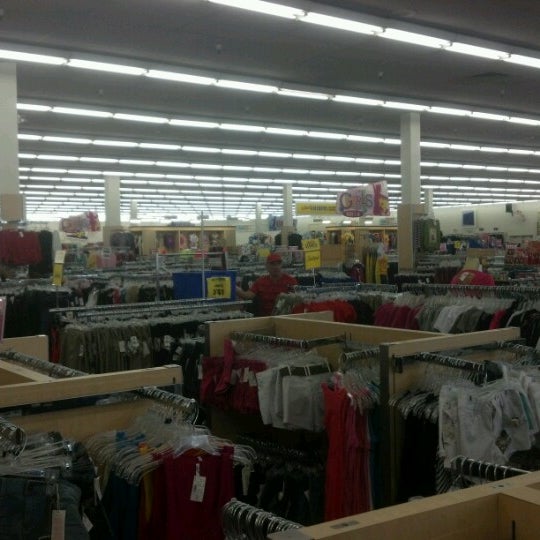
Find the location of `ceiling`. ceiling is located at coordinates (139, 148).